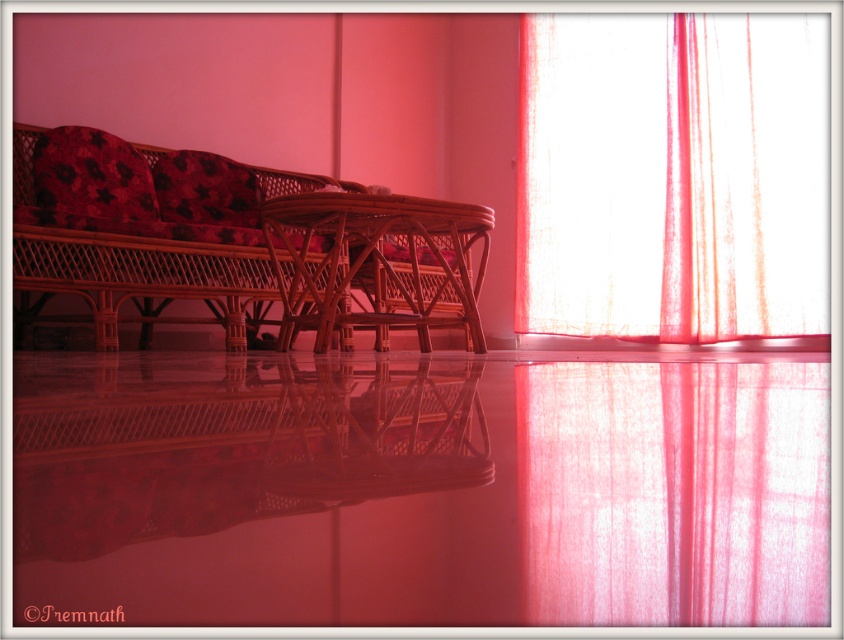
Is sheer white curtain at right bigger than woven wood couch at left?

Incorrect, sheer white curtain at right is not larger than woven wood couch at left.

Between sheer white curtain at right and woven wood couch at left, which one appears on the right side from the viewer's perspective?

Positioned to the right is sheer white curtain at right.

Where is `sheer white curtain at right`? sheer white curtain at right is located at coordinates (674, 492).

Who is positioned more to the right, sheer white curtain at right or woven wood armchair at center?

Positioned to the right is sheer white curtain at right.

Measure the distance between point (717, 468) and camera.

They are 38.69 centimeters apart.

This screenshot has width=844, height=640. In order to click on sheer white curtain at right in this screenshot , I will do `click(674, 492)`.

Can you confirm if floral fabric pillow at left is wider than floral fabric pillow at upper left?

Incorrect, floral fabric pillow at left's width does not surpass floral fabric pillow at upper left's.

Is point (82, 204) more distant than point (206, 189)?

No, it is not.

Locate an element on the screen. The width and height of the screenshot is (844, 640). floral fabric pillow at left is located at coordinates (92, 173).